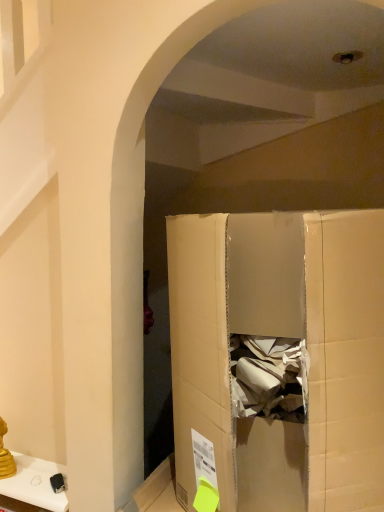
Image resolution: width=384 pixels, height=512 pixels. I want to click on free spot above metallic gold candlestick at lower left (from a real-world perspective), so click(x=34, y=472).